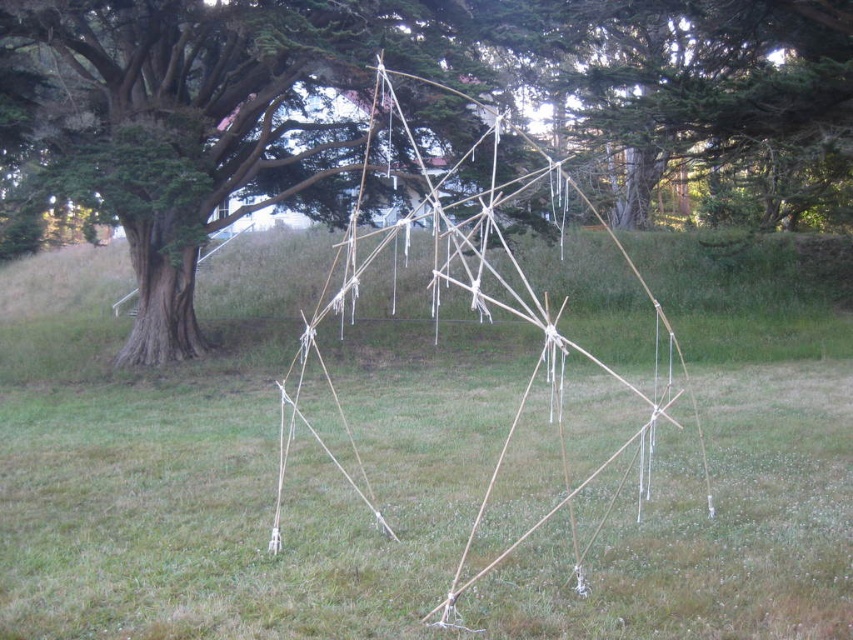
Which is more to the right, green grass at center or brown wood tree at center?

brown wood tree at center is more to the right.

Can you confirm if green grass at center is bigger than brown wood tree at center?

Incorrect, green grass at center is not larger than brown wood tree at center.

Which is behind, point (589, 600) or point (386, 51)?

Positioned behind is point (386, 51).

Find the location of a particular element. Image resolution: width=853 pixels, height=640 pixels. green grass at center is located at coordinates (234, 456).

Between brown wood tree at center and natural wood stick structure at center, which one is positioned higher?

Positioned higher is brown wood tree at center.

Identify the location of brown wood tree at center. (412, 108).

Where is `brown wood tree at center`? The image size is (853, 640). brown wood tree at center is located at coordinates (412, 108).

Is point (762, 472) closer to camera compared to point (463, 547)?

No, (762, 472) is further to viewer.

Between green grass at center and natural wood stick structure at center, which one is positioned lower?

green grass at center is lower down.

I want to click on green grass at center, so click(x=234, y=456).